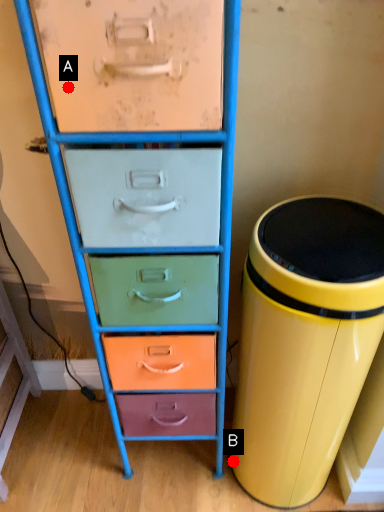
Question: Two points are circled on the image, labeled by A and B beside each circle. Which point is closer to the camera?

Choices:
 (A) A is closer
 (B) B is closer

Answer: (A)